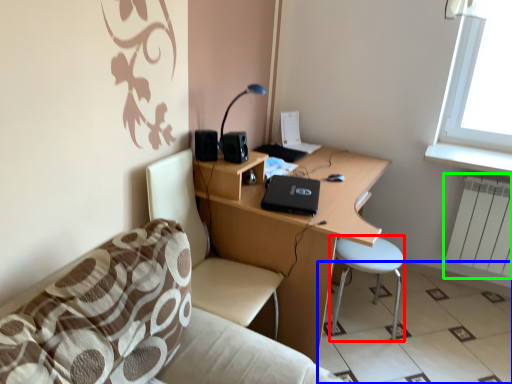
Question: Which is farther away from bar stool (highlighted by a red box)? tile (highlighted by a blue box) or radiator (highlighted by a green box)?

Choices:
 (A) tile
 (B) radiator

Answer: (B)